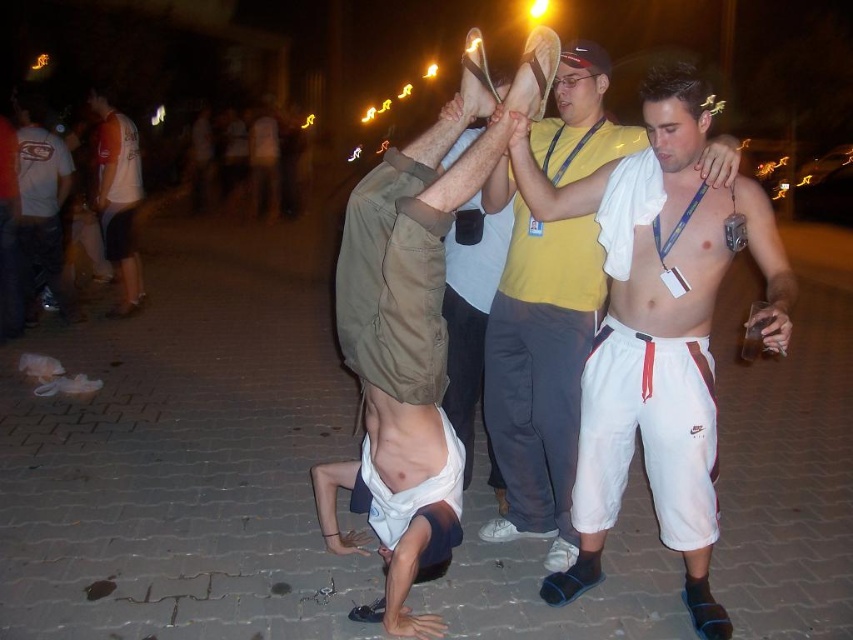
Which of these two, tan cotton shirt at center or white cotton shirt at upper left, stands shorter?

white cotton shirt at upper left

Is tan cotton shirt at center shorter than white cotton shirt at upper left?

Incorrect, tan cotton shirt at center's height does not fall short of white cotton shirt at upper left's.

Where is `tan cotton shirt at center`? tan cotton shirt at center is located at coordinates (415, 332).

Locate an element on the screen. The height and width of the screenshot is (640, 853). tan cotton shirt at center is located at coordinates (415, 332).

Can you confirm if white cotton shorts at center is bigger than white cotton shirt at left?

Yes, white cotton shorts at center is bigger than white cotton shirt at left.

The height and width of the screenshot is (640, 853). What are the coordinates of `white cotton shorts at center` in the screenshot? It's located at (538, 364).

Who is lower down, tan cotton shirt at center or white cotton shirt at left?

tan cotton shirt at center

Does tan cotton shirt at center appear on the left side of white cotton shirt at left?

In fact, tan cotton shirt at center is to the right of white cotton shirt at left.

The height and width of the screenshot is (640, 853). In order to click on tan cotton shirt at center in this screenshot , I will do `click(415, 332)`.